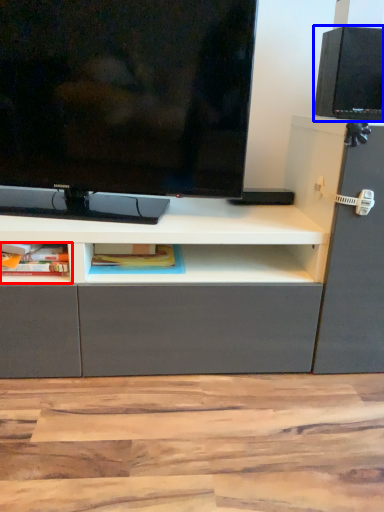
Question: Which object appears closest to the camera in this image, cabinet (highlighted by a red box) or speaker (highlighted by a blue box)?

Choices:
 (A) cabinet
 (B) speaker

Answer: (A)